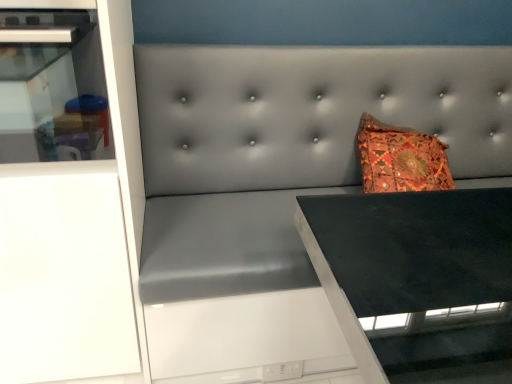
Question: From a real-world perspective, relative to white glossy cabinet at left, is white matte cabinet at left vertically above or below?

Choices:
 (A) above
 (B) below

Answer: (B)

Question: Considering the positions of white matte cabinet at left and white glossy cabinet at left in the image, is white matte cabinet at left bigger or smaller than white glossy cabinet at left?

Choices:
 (A) big
 (B) small

Answer: (A)

Question: Choose the correct answer: Is white matte cabinet at left inside white glossy cabinet at left or outside it?

Choices:
 (A) inside
 (B) outside

Answer: (B)

Question: Considering their positions, is white glossy cabinet at left located in front of or behind white matte cabinet at left?

Choices:
 (A) behind
 (B) front

Answer: (B)

Question: Looking at their shapes, would you say white glossy cabinet at left is wider or thinner than white matte cabinet at left?

Choices:
 (A) thin
 (B) wide

Answer: (B)

Question: Based on their sizes in the image, would you say white glossy cabinet at left is bigger or smaller than white matte cabinet at left?

Choices:
 (A) small
 (B) big

Answer: (A)

Question: From the image's perspective, is white glossy cabinet at left positioned above or below white matte cabinet at left?

Choices:
 (A) below
 (B) above

Answer: (B)